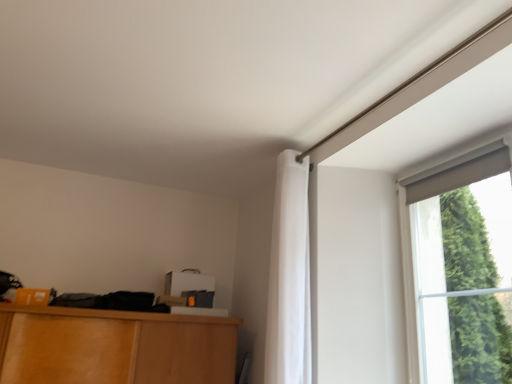
What do you see at coordinates (460, 270) in the screenshot?
I see `matte gray curtain at upper right` at bounding box center [460, 270].

Locate an element on the screen. matte gray curtain at upper right is located at coordinates 460,270.

This screenshot has width=512, height=384. Identify the location of white fabric curtain at upper right. (289, 276).

What do you see at coordinates (289, 276) in the screenshot? Image resolution: width=512 pixels, height=384 pixels. I see `white fabric curtain at upper right` at bounding box center [289, 276].

This screenshot has width=512, height=384. Identify the location of matte gray curtain at upper right. (460, 270).

Is white fabric curtain at upper right at the left side of matte gray curtain at upper right?

Indeed, white fabric curtain at upper right is positioned on the left side of matte gray curtain at upper right.

Does white fabric curtain at upper right come in front of matte gray curtain at upper right?

No, it is not.

Which is farther from the camera, (x=292, y=292) or (x=477, y=238)?

The point (x=477, y=238) is farther.

From the image's perspective, who appears lower, white fabric curtain at upper right or matte gray curtain at upper right?

white fabric curtain at upper right.

From a real-world perspective, which is physically below, white fabric curtain at upper right or matte gray curtain at upper right?

matte gray curtain at upper right is physically lower.

Considering the sizes of objects white fabric curtain at upper right and matte gray curtain at upper right in the image provided, who is wider, white fabric curtain at upper right or matte gray curtain at upper right?

With larger width is white fabric curtain at upper right.

Considering the sizes of objects white fabric curtain at upper right and matte gray curtain at upper right in the image provided, who is shorter, white fabric curtain at upper right or matte gray curtain at upper right?

matte gray curtain at upper right.

Can you confirm if white fabric curtain at upper right is bigger than matte gray curtain at upper right?

Yes.

Is matte gray curtain at upper right completely or partially inside white fabric curtain at upper right?

That's incorrect, matte gray curtain at upper right is not inside white fabric curtain at upper right.

Looking at this image, are white fabric curtain at upper right and matte gray curtain at upper right far apart?

No, white fabric curtain at upper right is not far away from matte gray curtain at upper right.

Is white fabric curtain at upper right positioned with its back to matte gray curtain at upper right?

No, white fabric curtain at upper right's orientation is not away from matte gray curtain at upper right.

How different are the orientations of white fabric curtain at upper right and matte gray curtain at upper right in degrees?

1.04 degrees.

What are the coordinates of `curtain above the matte gray curtain at upper right (from a real-world perspective)` in the screenshot? It's located at (289, 276).

Consider the image. Is matte gray curtain at upper right to the right of white fabric curtain at upper right from the viewer's perspective?

Correct, you'll find matte gray curtain at upper right to the right of white fabric curtain at upper right.

Which object is closer to the camera, matte gray curtain at upper right or white fabric curtain at upper right?

matte gray curtain at upper right.

Is point (433, 292) less distant than point (308, 334)?

No, it is behind (308, 334).

From the image's perspective, which one is positioned lower, matte gray curtain at upper right or white fabric curtain at upper right?

From the image's view, white fabric curtain at upper right is below.

Looking at this image, from a real-world perspective, relative to white fabric curtain at upper right, is matte gray curtain at upper right vertically above or below?

From a real-world perspective, matte gray curtain at upper right is physically below white fabric curtain at upper right.

Can you confirm if matte gray curtain at upper right is thinner than white fabric curtain at upper right?

Correct, the width of matte gray curtain at upper right is less than that of white fabric curtain at upper right.

Considering the sizes of objects matte gray curtain at upper right and white fabric curtain at upper right in the image provided, who is taller, matte gray curtain at upper right or white fabric curtain at upper right?

Standing taller between the two is white fabric curtain at upper right.

Based on the photo, can you confirm if matte gray curtain at upper right is bigger than white fabric curtain at upper right?

Actually, matte gray curtain at upper right might be smaller than white fabric curtain at upper right.

Would you say white fabric curtain at upper right is part of matte gray curtain at upper right's contents?

No, white fabric curtain at upper right is not a part of matte gray curtain at upper right.

Are matte gray curtain at upper right and white fabric curtain at upper right making contact?

No, matte gray curtain at upper right is not touching white fabric curtain at upper right.

Is matte gray curtain at upper right oriented away from white fabric curtain at upper right?

No, matte gray curtain at upper right is not facing the opposite direction of white fabric curtain at upper right.

How different are the orientations of matte gray curtain at upper right and white fabric curtain at upper right in degrees?

1.04 degrees.

Identify the location of curtain positioned vertically above the matte gray curtain at upper right (from a real-world perspective). The height and width of the screenshot is (384, 512). (289, 276).

This screenshot has width=512, height=384. In order to click on curtain lying below the matte gray curtain at upper right (from the image's perspective) in this screenshot , I will do `click(289, 276)`.

Find the location of a particular element. curtain behind the matte gray curtain at upper right is located at coordinates (289, 276).